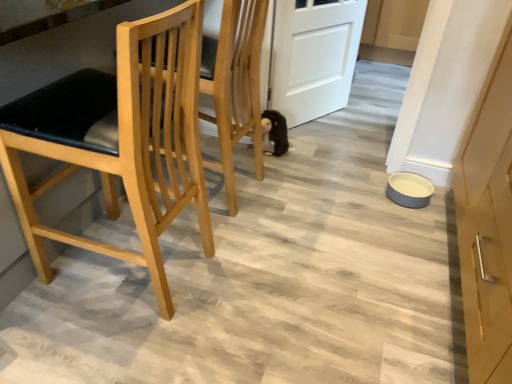
Find the location of `natural wood chair at left`. natural wood chair at left is located at coordinates (120, 139).

You are a GUI agent. You are given a task and a screenshot of the screen. Output one action in this format:
    pyautogui.click(x=<x>, y=<y>)
    Task: Click on the white matte door at center
    
    Given the screenshot: What is the action you would take?
    pyautogui.click(x=314, y=56)

Can you confirm if natural wood chair at left is positioned to the right of black plush toy at center?

No, natural wood chair at left is not to the right of black plush toy at center.

Based on the photo, who is bigger, natural wood chair at left or black plush toy at center?

Bigger between the two is natural wood chair at left.

The width and height of the screenshot is (512, 384). In order to click on animal on the right side of natural wood chair at left in this screenshot , I will do `click(275, 131)`.

From their relative heights in the image, would you say natural wood chair at left is taller or shorter than white matte door at center?

natural wood chair at left is taller than white matte door at center.

Can you tell me how much natural wood chair at left and white matte door at center differ in facing direction?

149 degrees separate the facing orientations of natural wood chair at left and white matte door at center.

Who is more distant, natural wood chair at left or white matte door at center?

white matte door at center is further away from the camera.

Which object is wider, black plush toy at center or white matte door at center?

black plush toy at center.

Considering the relative sizes of black plush toy at center and white matte door at center in the image provided, is black plush toy at center shorter than white matte door at center?

Yes.

Does point (295, 44) come closer to viewer compared to point (271, 119)?

No, it is behind (271, 119).

Which of these two, white matte door at center or black plush toy at center, is bigger?

Bigger between the two is white matte door at center.

Is black plush toy at center inside white matte door at center?

Definitely not — black plush toy at center is not inside white matte door at center.

Can you confirm if white matte door at center is wider than natural wood chair at left?

In fact, white matte door at center might be narrower than natural wood chair at left.

Considering the relative sizes of white matte door at center and natural wood chair at left in the image provided, is white matte door at center taller than natural wood chair at left?

No, white matte door at center is not taller than natural wood chair at left.

Which object is further away from the camera, white matte door at center or natural wood chair at left?

white matte door at center is further away from the camera.

Is white matte door at center completely or partially outside of natural wood chair at left?

Indeed, white matte door at center is completely outside natural wood chair at left.

Locate an element on the screen. animal located on the right of natural wood chair at left is located at coordinates (275, 131).

Does black plush toy at center have a greater height compared to natural wood chair at left?

No.

Which is more to the left, black plush toy at center or natural wood chair at left?

natural wood chair at left is more to the left.

Is black plush toy at center facing away from natural wood chair at left?

No, natural wood chair at left is not at the back of black plush toy at center.

Locate an element on the screen. Image resolution: width=512 pixels, height=384 pixels. chair in front of the black plush toy at center is located at coordinates point(120,139).

Locate an element on the screen. This screenshot has width=512, height=384. door above the natural wood chair at left (from the image's perspective) is located at coordinates (x=314, y=56).

From the image, which object appears to be nearer to natural wood chair at left, white matte door at center or black plush toy at center?

black plush toy at center lies closer to natural wood chair at left than the other object.

Estimate the real-world distances between objects in this image. Which object is further from white matte door at center, natural wood chair at left or black plush toy at center?

Based on the image, natural wood chair at left appears to be further to white matte door at center.

When comparing their distances from black plush toy at center, does white matte door at center or natural wood chair at left seem further?

natural wood chair at left.

Estimate the real-world distances between objects in this image. Which object is further from natural wood chair at left, black plush toy at center or white matte door at center?

Based on the image, white matte door at center appears to be further to natural wood chair at left.

From the image, which object appears to be nearer to black plush toy at center, natural wood chair at left or white matte door at center?

Among the two, white matte door at center is located nearer to black plush toy at center.

Looking at the image, which one is located closer to white matte door at center, black plush toy at center or natural wood chair at left?

Among the two, black plush toy at center is located nearer to white matte door at center.

Where is `door between natural wood chair at left and black plush toy at center in the front-back direction`? The width and height of the screenshot is (512, 384). door between natural wood chair at left and black plush toy at center in the front-back direction is located at coordinates (314, 56).